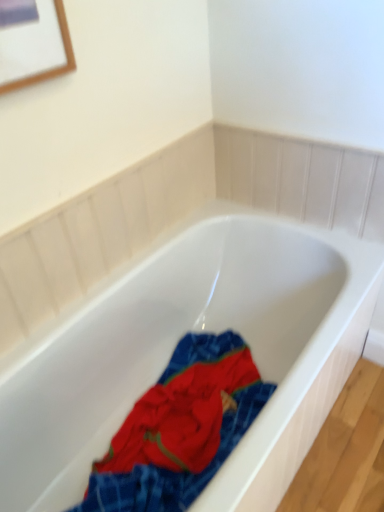
This screenshot has width=384, height=512. In order to click on white glossy bathtub at center in this screenshot , I will do `click(175, 344)`.

The image size is (384, 512). Describe the element at coordinates (175, 344) in the screenshot. I see `white glossy bathtub at center` at that location.

Image resolution: width=384 pixels, height=512 pixels. What do you see at coordinates (179, 429) in the screenshot?
I see `textured cotton towel at center` at bounding box center [179, 429].

Locate an element on the screen. The image size is (384, 512). textured cotton towel at center is located at coordinates (179, 429).

Locate an element on the screen. Image resolution: width=384 pixels, height=512 pixels. white glossy bathtub at center is located at coordinates (175, 344).

Does textured cotton towel at center appear on the left side of white glossy bathtub at center?

Correct, you'll find textured cotton towel at center to the left of white glossy bathtub at center.

Which object is further away from the camera taking this photo, textured cotton towel at center or white glossy bathtub at center?

textured cotton towel at center is further away from the camera.

Which is farther, (157,477) or (96,456)?

The point (96,456) is farther from the camera.

In the scene shown: From the image's perspective, which one is positioned higher, textured cotton towel at center or white glossy bathtub at center?

white glossy bathtub at center, from the image's perspective.

From a real-world perspective, is textured cotton towel at center above or below white glossy bathtub at center?

textured cotton towel at center is situated lower than white glossy bathtub at center in the real world.

Considering the sizes of objects textured cotton towel at center and white glossy bathtub at center in the image provided, who is wider, textured cotton towel at center or white glossy bathtub at center?

white glossy bathtub at center is wider.

Consider the image. In terms of height, does textured cotton towel at center look taller or shorter compared to white glossy bathtub at center?

textured cotton towel at center is shorter than white glossy bathtub at center.

Considering the relative sizes of textured cotton towel at center and white glossy bathtub at center in the image provided, is textured cotton towel at center bigger than white glossy bathtub at center?

Actually, textured cotton towel at center might be smaller than white glossy bathtub at center.

Is textured cotton towel at center located outside white glossy bathtub at center?

No, textured cotton towel at center is inside or overlapping with white glossy bathtub at center.

Is textured cotton towel at center far from white glossy bathtub at center?

textured cotton towel at center is near white glossy bathtub at center, not far away.

Is textured cotton towel at center positioned with its back to white glossy bathtub at center?

Yes.

Where is `material on the left of white glossy bathtub at center`? Image resolution: width=384 pixels, height=512 pixels. material on the left of white glossy bathtub at center is located at coordinates (179, 429).

Considering the relative positions of white glossy bathtub at center and textured cotton towel at center in the image provided, is white glossy bathtub at center to the left or to the right of textured cotton towel at center?

In the image, white glossy bathtub at center appears on the right side of textured cotton towel at center.

Is white glossy bathtub at center further to camera compared to textured cotton towel at center?

No, it is not.

Is point (142, 366) more distant than point (132, 480)?

Yes.

From the image's perspective, is white glossy bathtub at center over textured cotton towel at center?

Indeed, from the image's perspective, white glossy bathtub at center is shown above textured cotton towel at center.

From a real-world perspective, is white glossy bathtub at center under textured cotton towel at center?

No, from a real-world perspective, white glossy bathtub at center is not under textured cotton towel at center.

Is white glossy bathtub at center wider or thinner than textured cotton towel at center?

Considering their sizes, white glossy bathtub at center looks broader than textured cotton towel at center.

Who is taller, white glossy bathtub at center or textured cotton towel at center?

With more height is white glossy bathtub at center.

Who is smaller, white glossy bathtub at center or textured cotton towel at center?

With smaller size is textured cotton towel at center.

Is white glossy bathtub at center inside the boundaries of textured cotton towel at center, or outside?

Answer: The correct answer is: outside.

Is white glossy bathtub at center far from textured cotton towel at center?

That's not correct — white glossy bathtub at center is a little close to textured cotton towel at center.

Is white glossy bathtub at center facing towards textured cotton towel at center?

Yes, white glossy bathtub at center is aimed at textured cotton towel at center.

Measure the distance between white glossy bathtub at center and textured cotton towel at center.

white glossy bathtub at center is 7.89 inches away from textured cotton towel at center.

Locate an element on the screen. Image resolution: width=384 pixels, height=512 pixels. material below the white glossy bathtub at center (from the image's perspective) is located at coordinates (179, 429).

This screenshot has width=384, height=512. Find the location of `material on the left of white glossy bathtub at center`. material on the left of white glossy bathtub at center is located at coordinates (179, 429).

Locate an element on the screen. The height and width of the screenshot is (512, 384). bathtub that appears above the textured cotton towel at center (from the image's perspective) is located at coordinates (175, 344).